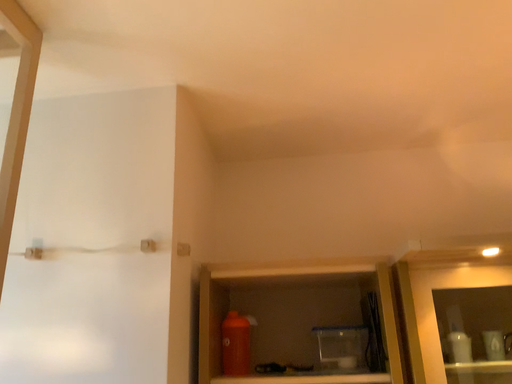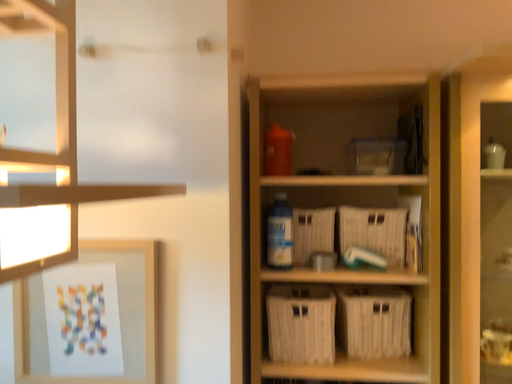
Question: Which way did the camera rotate in the video?

Choices:
 (A) rotated downward
 (B) rotated upward

Answer: (A)